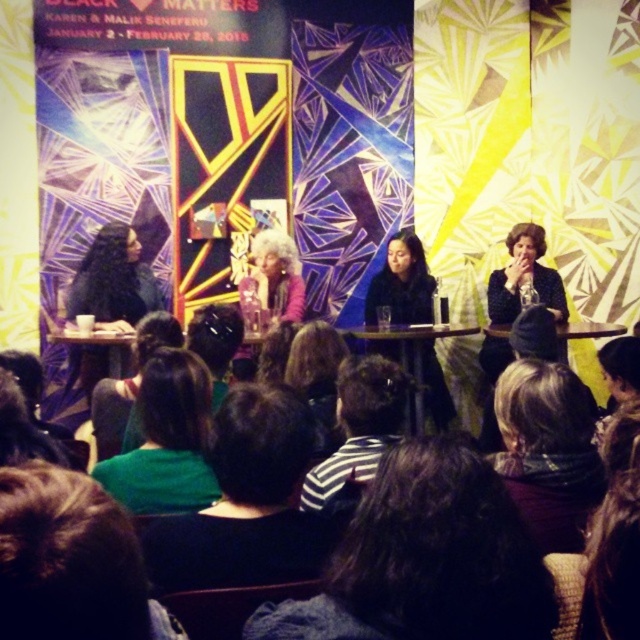
Question: Can you confirm if dark brown hair at lower center is bigger than fuzzy pink sweater at center?

Choices:
 (A) yes
 (B) no

Answer: (B)

Question: Which of the following is the farthest from the observer?

Choices:
 (A) (83, 374)
 (B) (433, 372)
 (C) (252, 244)
 (D) (227, 472)

Answer: (C)

Question: Among these objects, which one is farthest from the camera?

Choices:
 (A) matte black jacket at center
 (B) fuzzy pink sweater at center
 (C) green fabric at lower left
 (D) green fabric shirt at lower center

Answer: (A)

Question: Considering the real-world distances, which object is farthest from the striped fabric at center?

Choices:
 (A) fuzzy pink sweater at center
 (B) matte black jacket at center

Answer: (B)

Question: Is green fabric shirt at lower center to the left of fuzzy pink sweater at center from the viewer's perspective?

Choices:
 (A) no
 (B) yes

Answer: (A)

Question: In this image, where is striped fabric at center located relative to matte black jacket at center?

Choices:
 (A) left
 (B) right

Answer: (A)